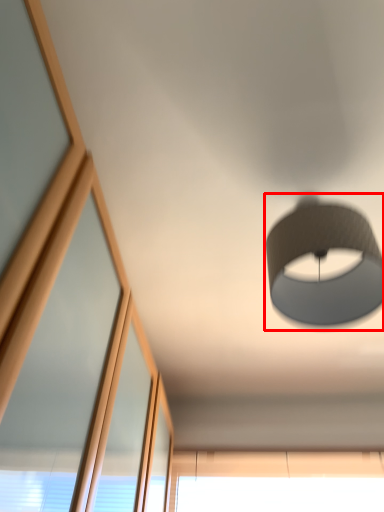
Question: Observing the image, what is the correct spatial positioning of lamp (annotated by the red box) in reference to window?

Choices:
 (A) left
 (B) right

Answer: (A)